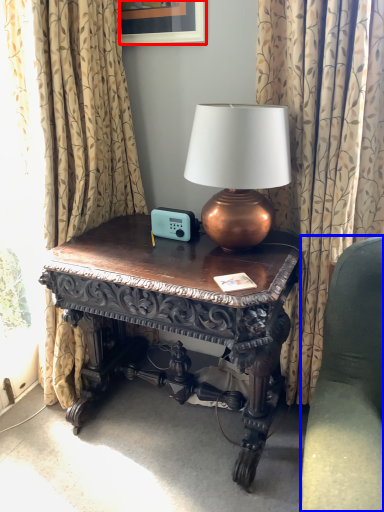
Question: Among these objects, which one is nearest to the camera, picture frame (highlighted by a red box) or studio couch (highlighted by a blue box)?

Choices:
 (A) picture frame
 (B) studio couch

Answer: (B)